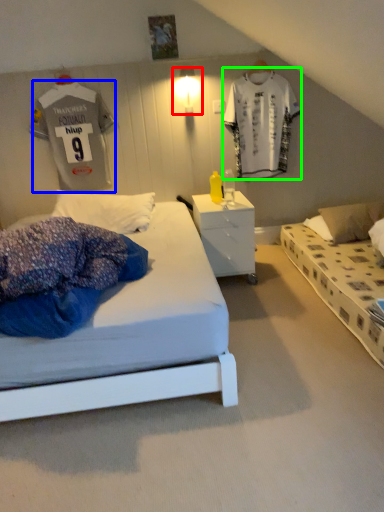
Question: Which object is positioned closest to light fixture (highlighted by a red box)? Select from t shirt (highlighted by a blue box) and t shirt (highlighted by a green box).

Choices:
 (A) t shirt
 (B) t shirt

Answer: (B)